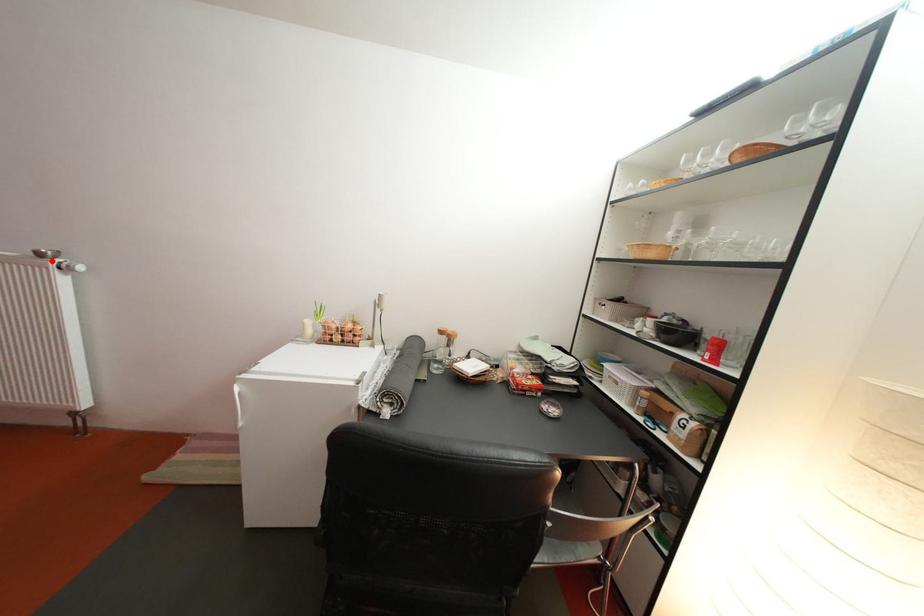
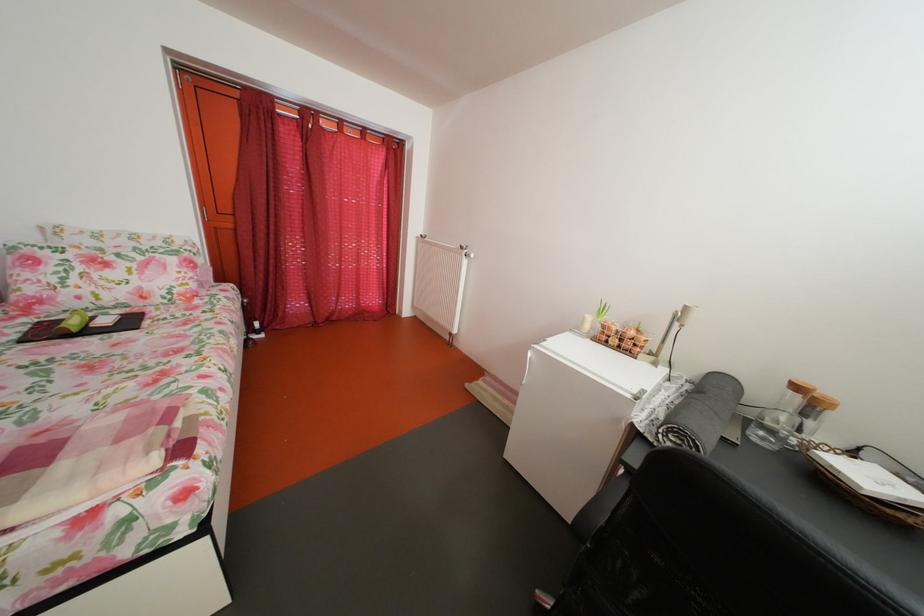
Question: A red point is marked in image1. In image2, is the corresponding 3D point closer to the camera or farther? Reply with the corresponding letter.

Choices:
 (A) The corresponding 3D point is closer.
 (B) The corresponding 3D point is farther.

Answer: (A)